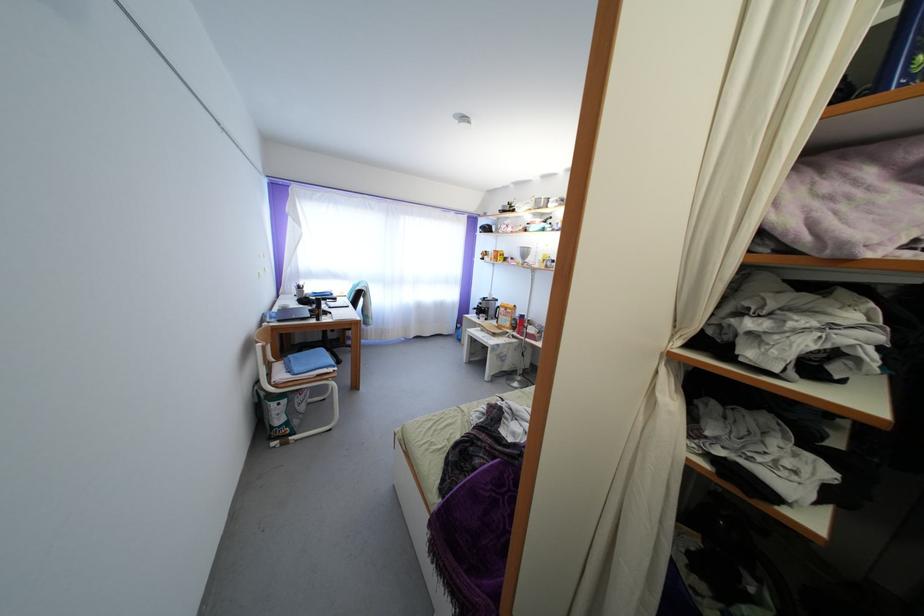
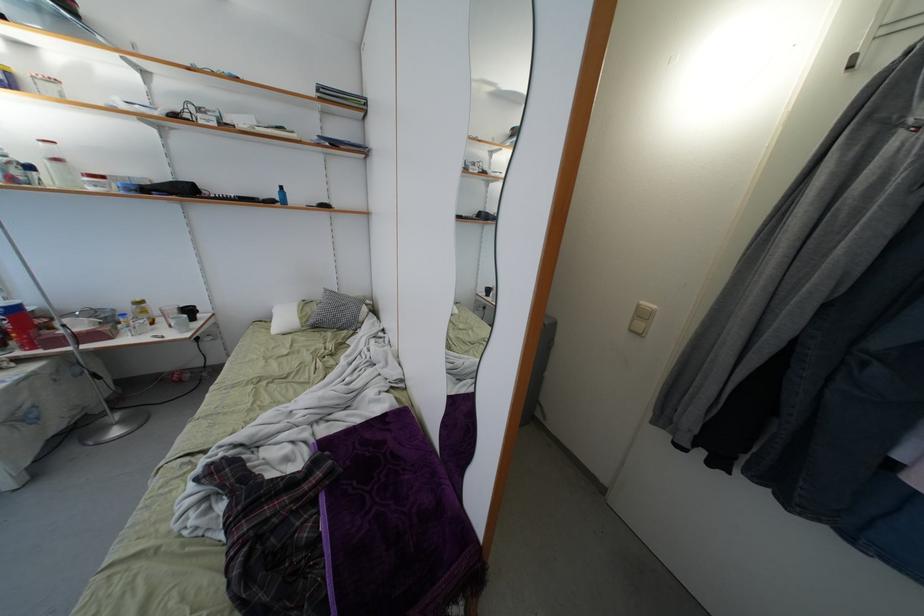
Where in the second image is the point corresponding to point (525, 330) from the first image?

(22, 333)